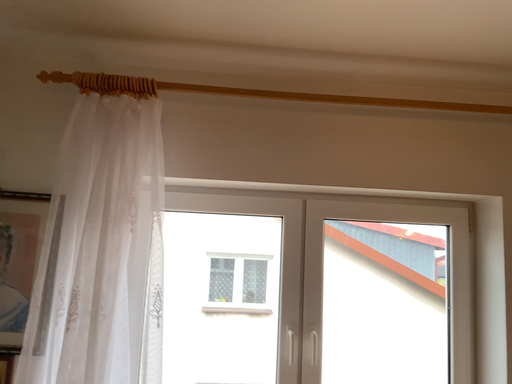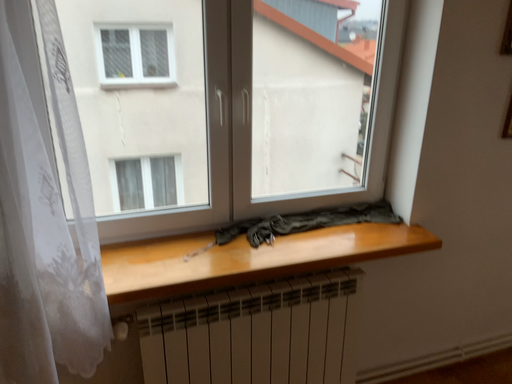
Question: How did the camera likely rotate when shooting the video?

Choices:
 (A) rotated right
 (B) rotated left

Answer: (A)